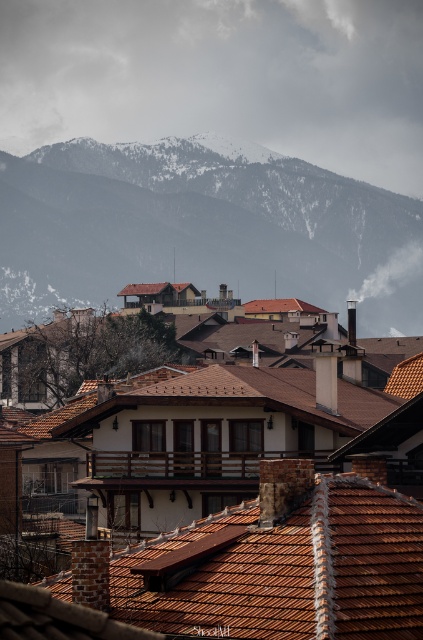
Question: Which object is closer to the camera taking this photo?

Choices:
 (A) brown tiled roof at center
 (B) brown tile roof at center

Answer: (A)

Question: Where is brown tiled roof at center located in relation to brown tile roof at center in the image?

Choices:
 (A) right
 (B) left

Answer: (B)

Question: Is white fluffy cloud at upper center above brown tile roof at center?

Choices:
 (A) yes
 (B) no

Answer: (A)

Question: Which point is farther to the camera?

Choices:
 (A) (5, 102)
 (B) (238, 637)
 (C) (233, 611)

Answer: (A)

Question: Which point is farther to the camera?

Choices:
 (A) white fluffy cloud at upper center
 (B) brown tiled roof at center
 (C) brown tile roof at center

Answer: (A)

Question: In this image, where is brown tiled roof at center located relative to brown tile roof at center?

Choices:
 (A) right
 (B) left

Answer: (B)